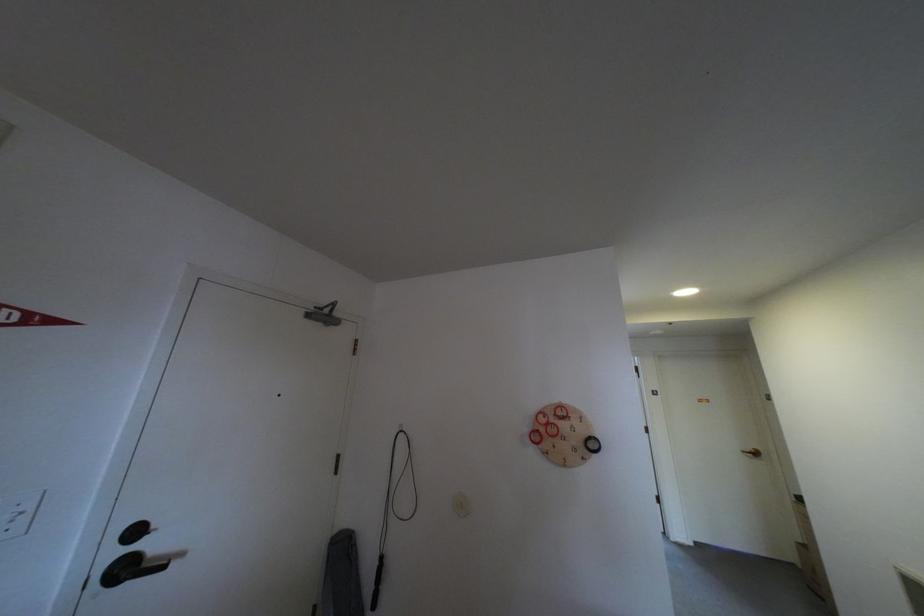
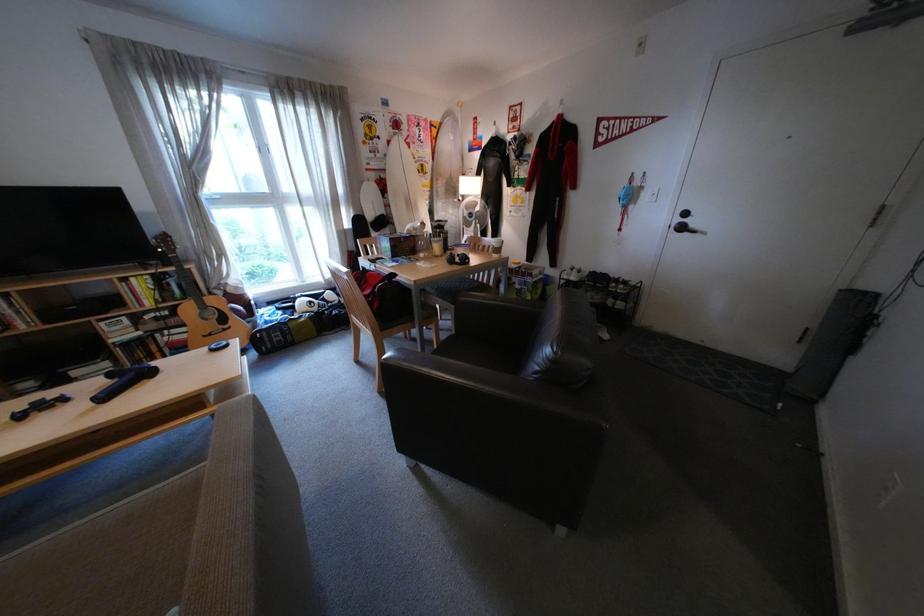
Where in the second image is the point corresponding to (140,570) from the first image?

(696, 229)